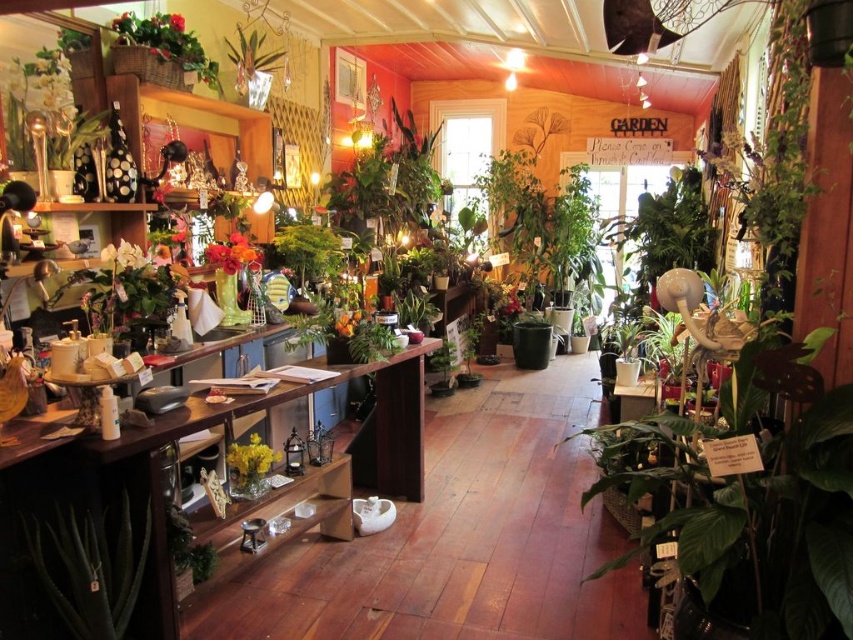
In the scene shown: You are standing in the flower shop and want to reach a point that is exactly 3.11 meters away from where you are currently standing. Can you determine if the point at coordinates point [292,516] is the correct location to reach?

The point [292,516] is exactly 3.11 meters from the camera, so yes, it is the correct location to reach.

You are a customer in the flower shop and want to place a small decorative item on the wooden shelf at lower left and the white matte flower at left. Which shelf can accommodate a larger item?

The wooden shelf at lower left is bigger than the white matte flower at left, so it can accommodate a larger item.